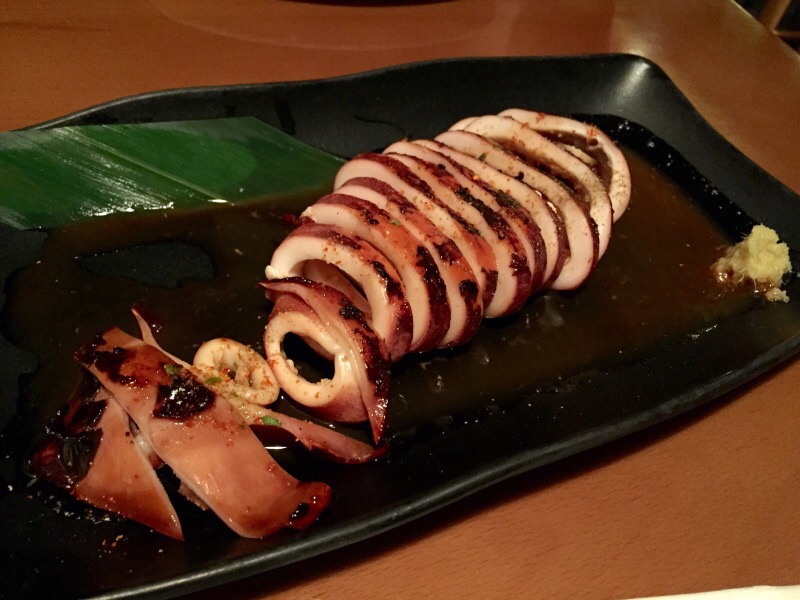
This screenshot has width=800, height=600. Identify the location of empty space on table. (669, 500).